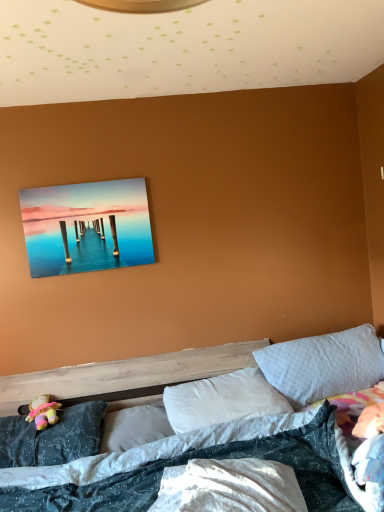
Where is `free spot above white soft pillow at center, the second pillow in the left-to-right sequence (from a real-world perspective)`? Image resolution: width=384 pixels, height=512 pixels. free spot above white soft pillow at center, the second pillow in the left-to-right sequence (from a real-world perspective) is located at coordinates (139, 411).